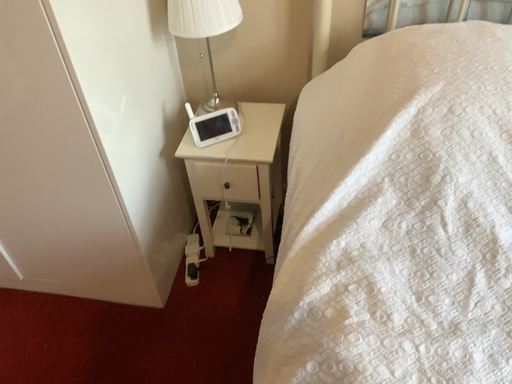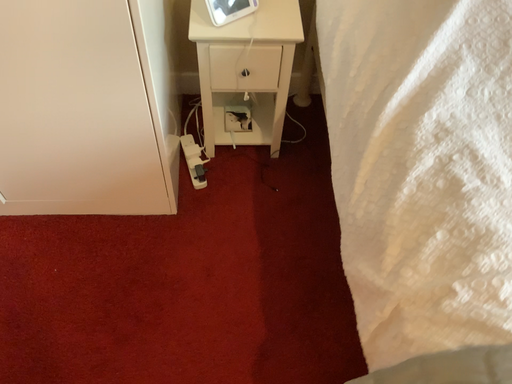
Question: How did the camera likely rotate when shooting the video?

Choices:
 (A) rotated left
 (B) rotated right

Answer: (B)